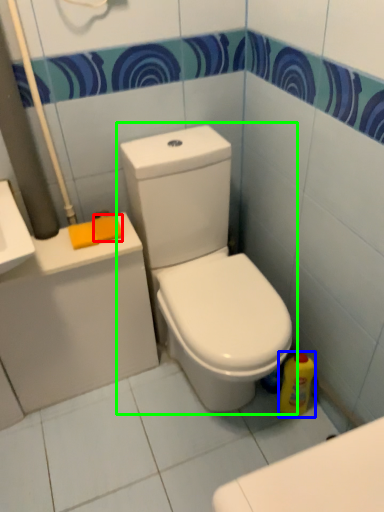
Question: Based on their relative distances, which object is nearer to soap (highlighted by a red box)? Choose from cleaning product (highlighted by a blue box) and toilet (highlighted by a green box).

Choices:
 (A) cleaning product
 (B) toilet

Answer: (B)